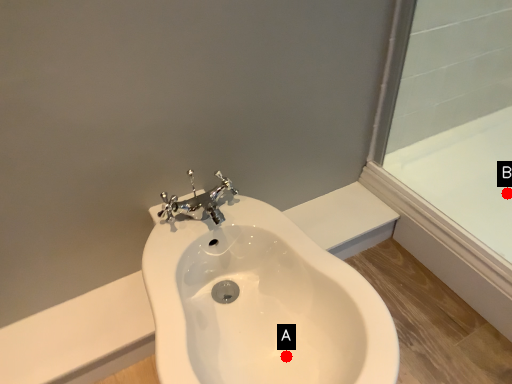
Question: Two points are circled on the image, labeled by A and B beside each circle. Which point is farther to the camera?

Choices:
 (A) A is further
 (B) B is further

Answer: (B)